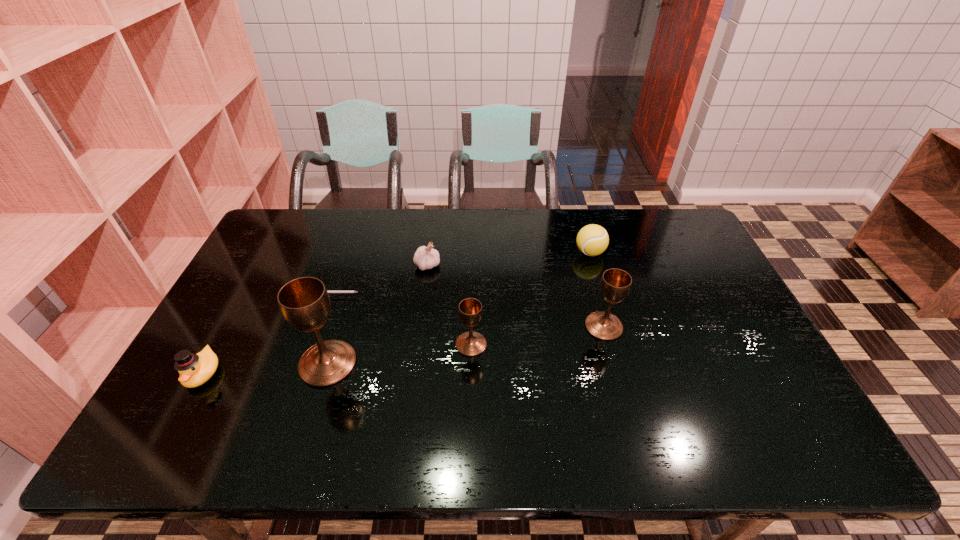
I want to click on vacant space that satisfies the following two spatial constraints: 1. on the back side of the tallest object; 2. on the right side of the second chalice from left to right, so click(334, 345).

You are a GUI agent. You are given a task and a screenshot of the screen. Output one action in this format:
    pyautogui.click(x=<x>, y=<y>)
    Task: Click on the free location that satisfies the following two spatial constraints: 1. at the tip of the second tallest chalice; 2. on the right side of the third farthest object
    
    Given the screenshot: What is the action you would take?
    pyautogui.click(x=314, y=327)

I want to click on free region that satisfies the following two spatial constraints: 1. at the tip of the shortest object; 2. on the front-facing side of the leftmost object, so click(297, 373).

At what (x,y) coordinates should I click in order to perform the action: click on free space that satisfies the following two spatial constraints: 1. on the back side of the tallest object; 2. on the right side of the third tallest object. Please return your answer as a coordinate pair (x, y). The image size is (960, 540). Looking at the image, I should click on (334, 345).

At what (x,y) coordinates should I click in order to perform the action: click on free space that satisfies the following two spatial constraints: 1. on the front side of the fourth object from right to left; 2. at the tip of the screwdriver. Please return your answer as a coordinate pair (x, y). Looking at the image, I should click on (423, 296).

Find the location of a particular element. This screenshot has height=540, width=960. vacant space that satisfies the following two spatial constraints: 1. at the tip of the screwdriver; 2. on the left side of the second shortest chalice is located at coordinates (314, 327).